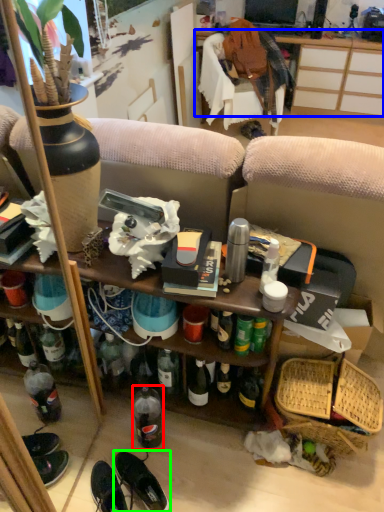
Question: Which object is positioned closest to bottle (highlighted by a red box)? Select from desk (highlighted by a blue box) and footwear (highlighted by a green box).

Choices:
 (A) desk
 (B) footwear

Answer: (B)